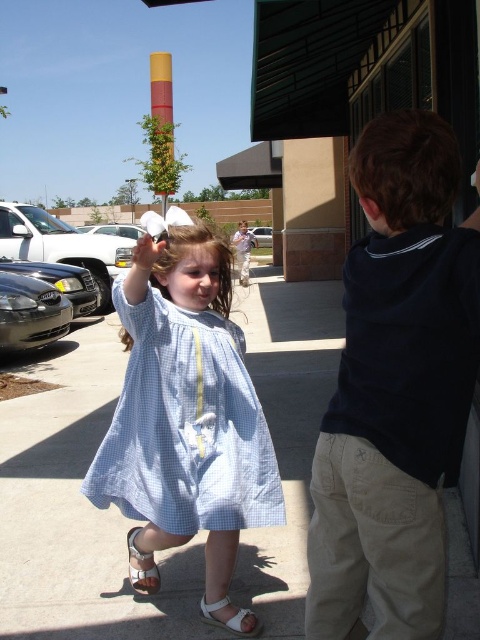
Question: Which object is the farthest from the white concrete pavement at center?

Choices:
 (A) white leather sandal at lower left
 (B) brown curly hair at upper right

Answer: (B)

Question: Can you confirm if white concrete pavement at center is positioned to the right of brown curly hair at upper right?

Choices:
 (A) no
 (B) yes

Answer: (A)

Question: Is brown curly hair at upper right above white fabric sandal at lower center?

Choices:
 (A) yes
 (B) no

Answer: (A)

Question: Which point is closer to the camera taking this photo?

Choices:
 (A) (411, 177)
 (B) (71, 392)
 (C) (237, 620)

Answer: (A)

Question: Does brown smooth hair at center appear on the left side of white fabric sandal at lower center?

Choices:
 (A) yes
 (B) no

Answer: (A)

Question: Which object appears closest to the camera in this image?

Choices:
 (A) brown curly hair at upper right
 (B) light blue gingham dress at center
 (C) dark blue shirt at right

Answer: (C)